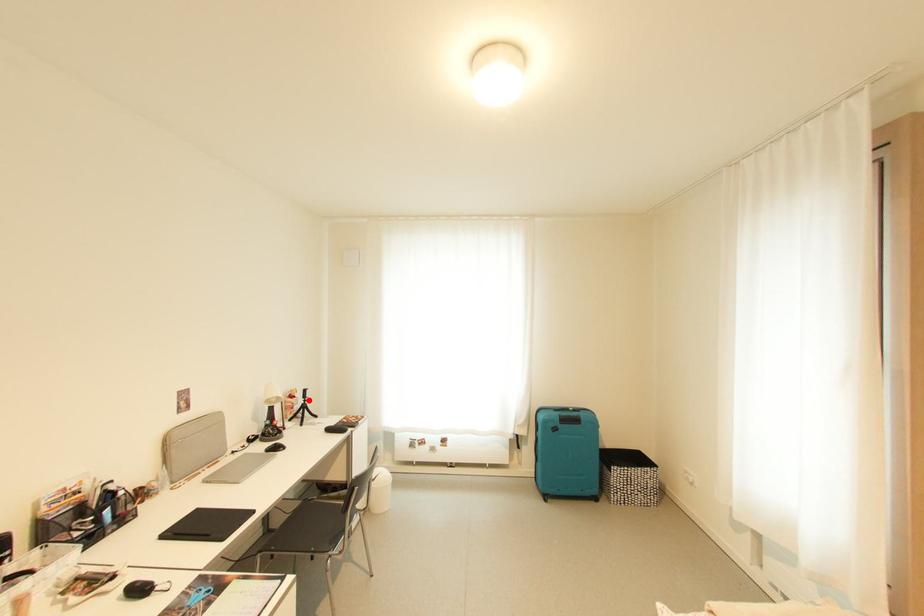
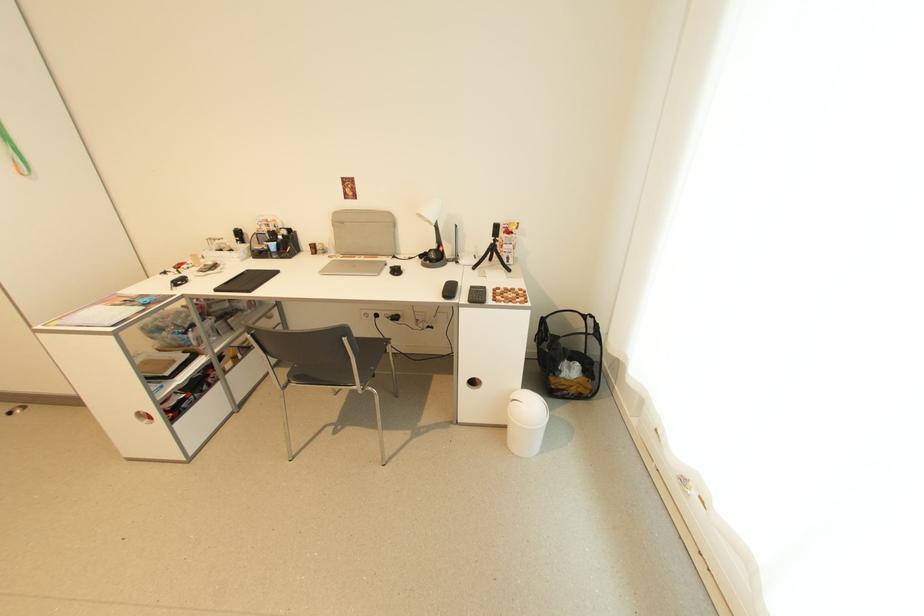
Question: I am providing you with two images of the same scene from different viewpoints. In image1, a red point is highlighted. Considering the same 3D point in image2, which of the following is correct?

Choices:
 (A) It is closer
 (B) It is farther

Answer: (A)